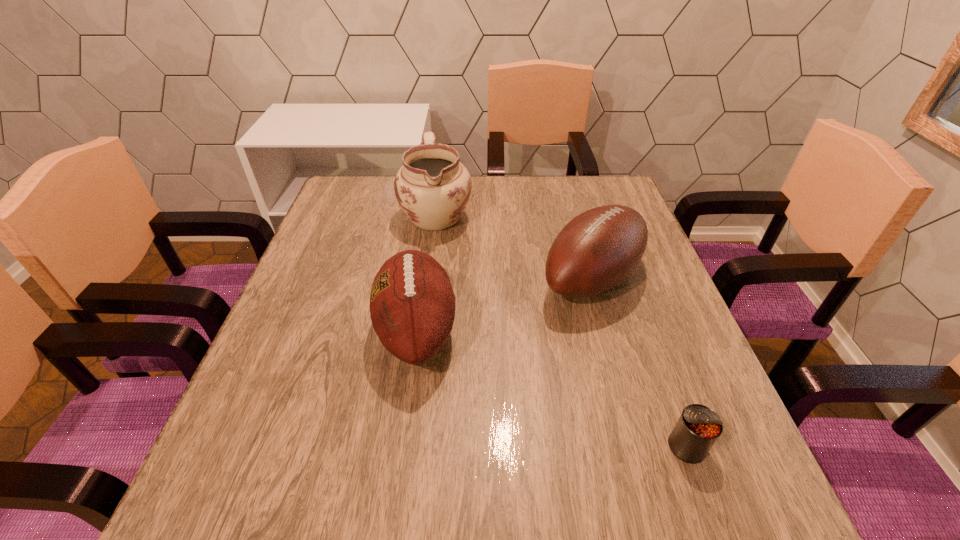
The width and height of the screenshot is (960, 540). Find the location of `pitcher`. pitcher is located at coordinates (432, 187).

The image size is (960, 540). Find the location of `the right football (American)`. the right football (American) is located at coordinates (597, 250).

This screenshot has height=540, width=960. Find the location of `the left football (American)`. the left football (American) is located at coordinates (412, 304).

You are a GUI agent. You are given a task and a screenshot of the screen. Output one action in this format:
    pyautogui.click(x=<x>, y=<y>)
    Task: Click on the shortest object
    The width and height of the screenshot is (960, 540).
    Given the screenshot: What is the action you would take?
    pyautogui.click(x=697, y=429)

Image resolution: width=960 pixels, height=540 pixels. What are the coordinates of `the nearest object` in the screenshot? It's located at (697, 429).

Locate an element on the screen. free region located 0.130m on the spout of the farthest object is located at coordinates (428, 275).

Find the location of a particular element. vacant space positioned 0.250m on the front of the right football (American) is located at coordinates (633, 426).

Identify the location of vacant space located on the right of the left football (American). (638, 331).

Where is `vacant area located on the front of the can`? The image size is (960, 540). vacant area located on the front of the can is located at coordinates (712, 517).

Where is `object at the far edge`? The height and width of the screenshot is (540, 960). object at the far edge is located at coordinates coord(432,187).